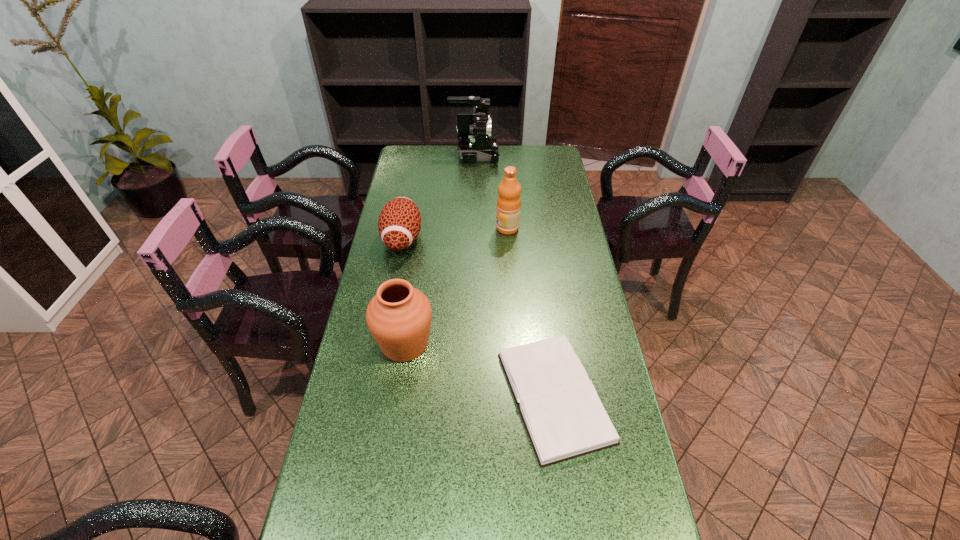
Identify the location of blank area in the image that satisfies the following two spatial constraints: 1. on the label side of the fruit juice; 2. on the back side of the shortest object. (519, 396).

Find the location of a particular element. This screenshot has width=960, height=540. free space in the image that satisfies the following two spatial constraints: 1. on the front side of the second shortest object; 2. on the right side of the urn is located at coordinates (382, 344).